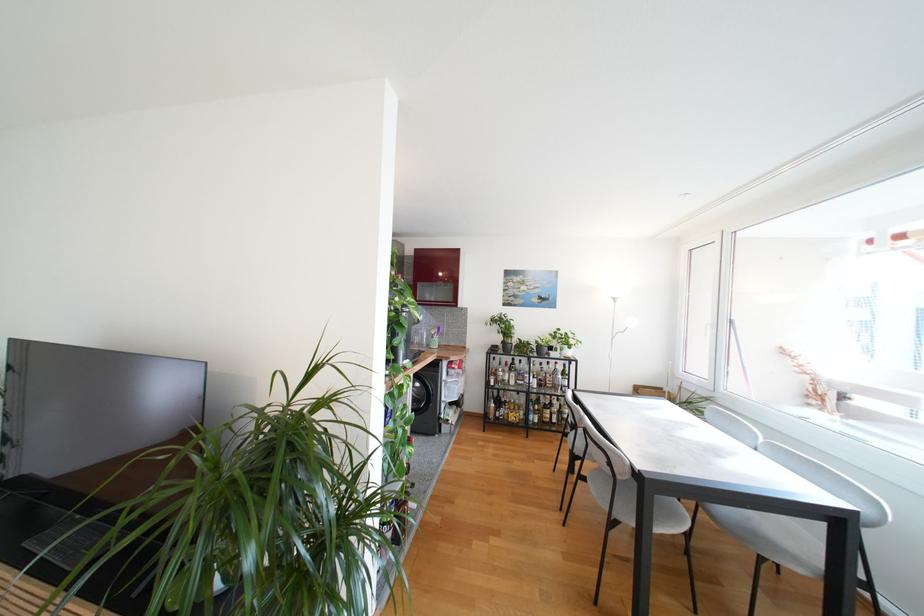
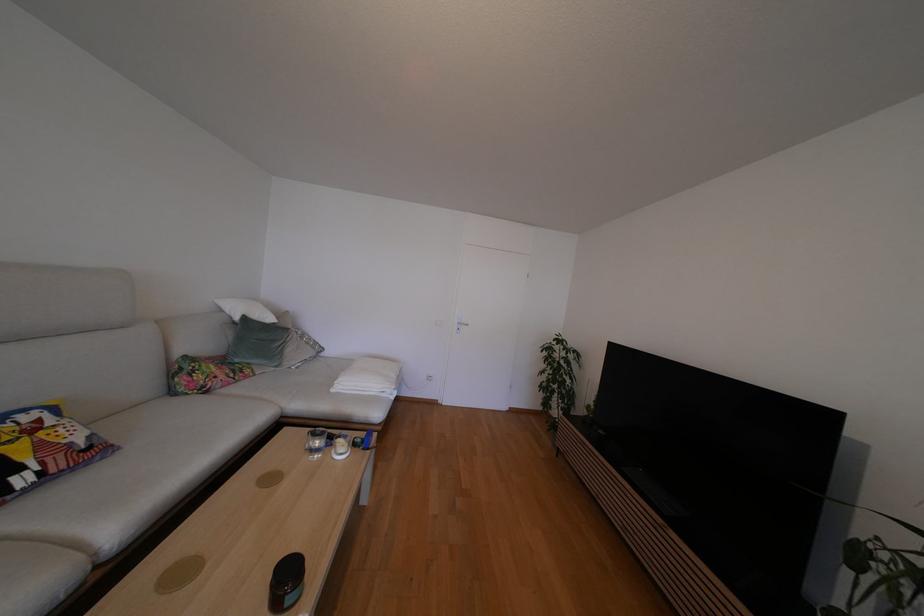
Question: The first image is from the beginning of the video and the second image is from the end. How did the camera likely rotate when shooting the video?

Choices:
 (A) Left
 (B) Right
 (C) Up
 (D) Down

Answer: (A)